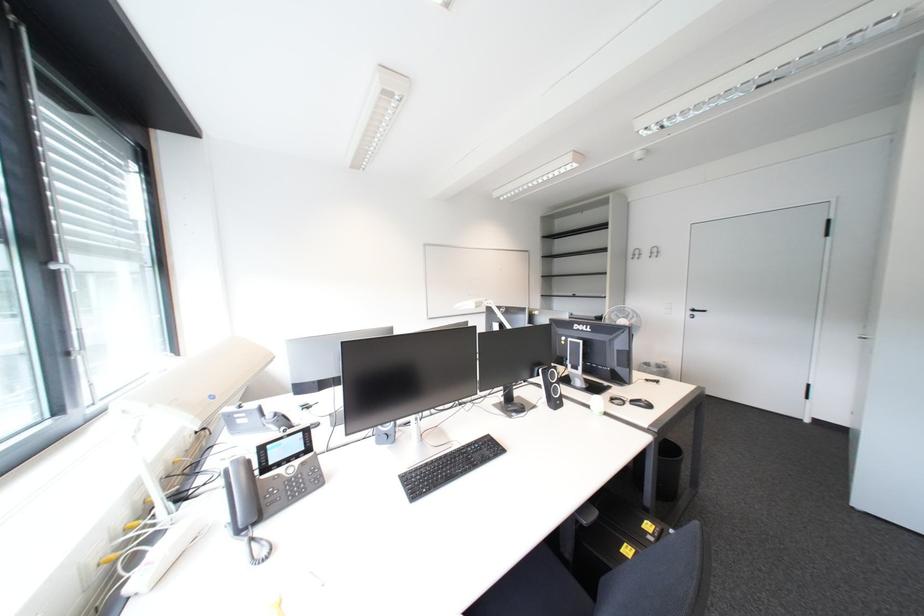
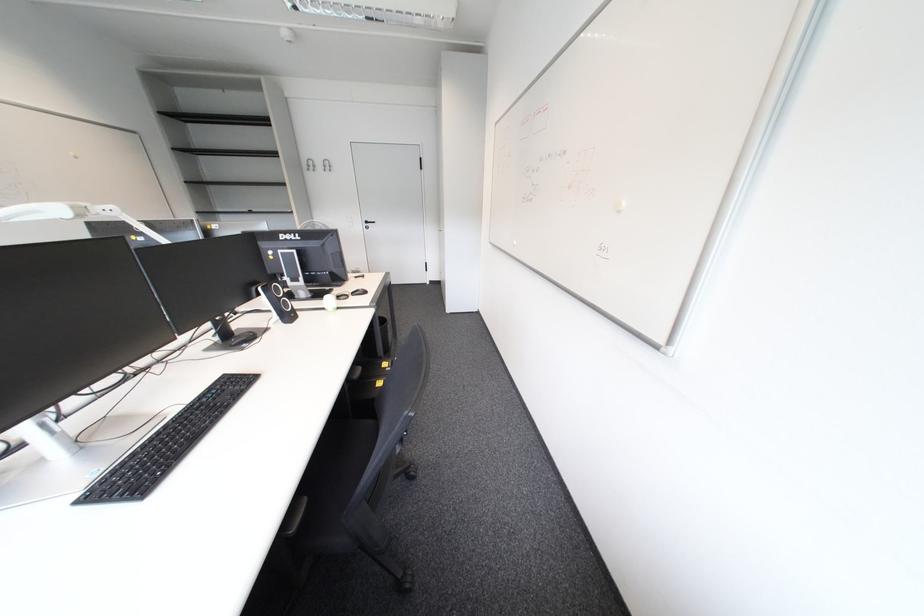
The images are taken continuously from a first-person perspective. In which direction is your viewpoint rotating?

The camera rotated toward right-down.